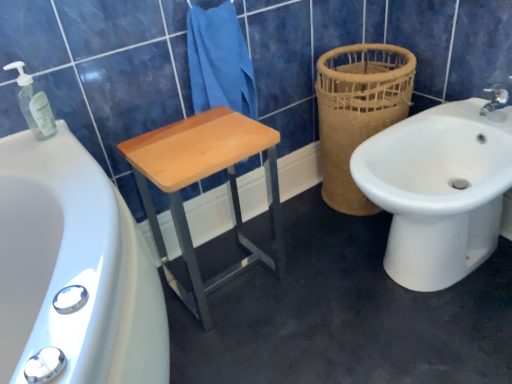
Identify the location of vacant space situated on the left part of white ceramic bidet at right. (310, 278).